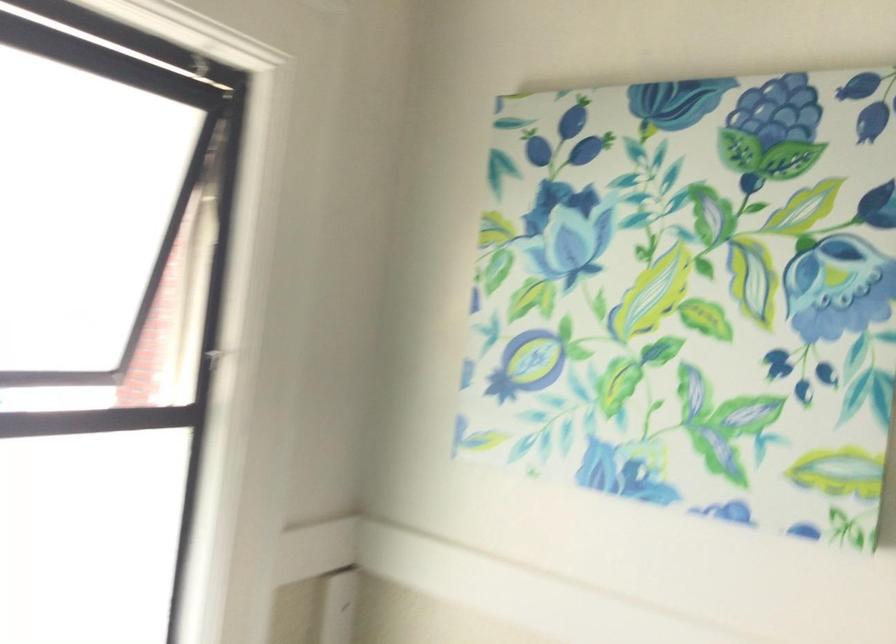
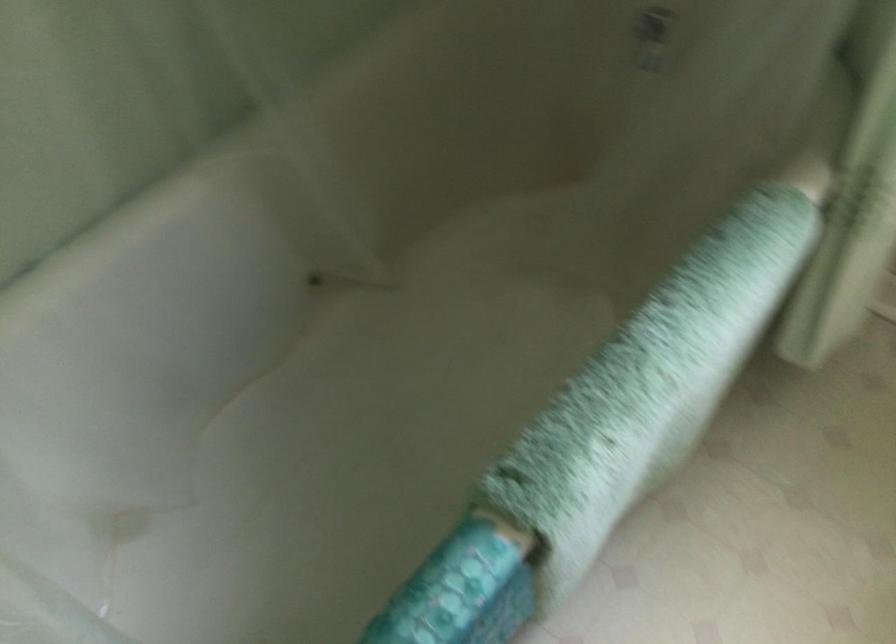
How did the camera likely rotate?

The rotation direction of the camera is left-down.